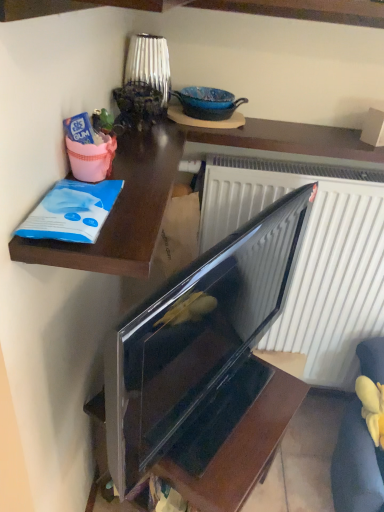
The height and width of the screenshot is (512, 384). I want to click on free space above blue plastic bag at upper left (from a real-world perspective), so click(x=142, y=159).